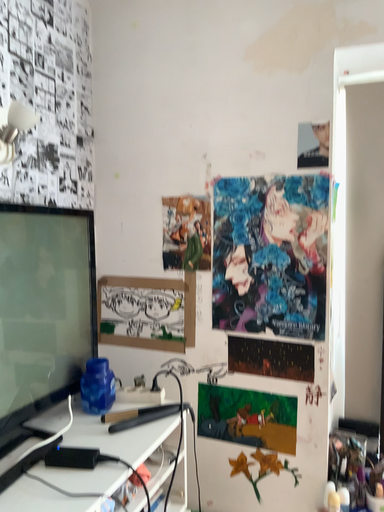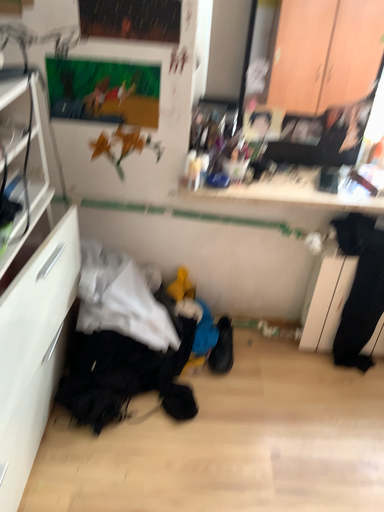
Question: Which way did the camera rotate in the video?

Choices:
 (A) rotated downward
 (B) rotated upward

Answer: (A)